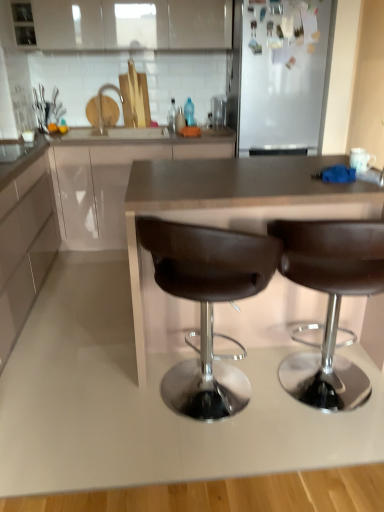
Where is `free space in front of brown leather stool at center, the 2th chair when ordered from right to left`? The image size is (384, 512). free space in front of brown leather stool at center, the 2th chair when ordered from right to left is located at coordinates (223, 462).